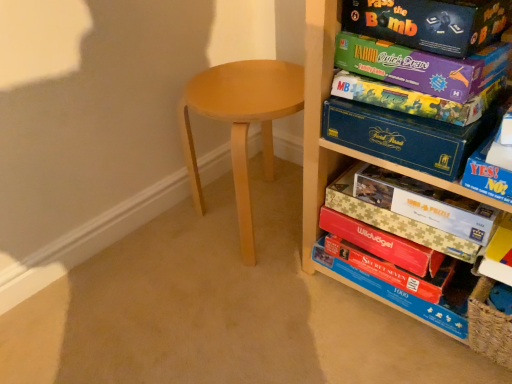
This screenshot has width=512, height=384. I want to click on free spot to the left of wooden shelf at right, so click(x=255, y=311).